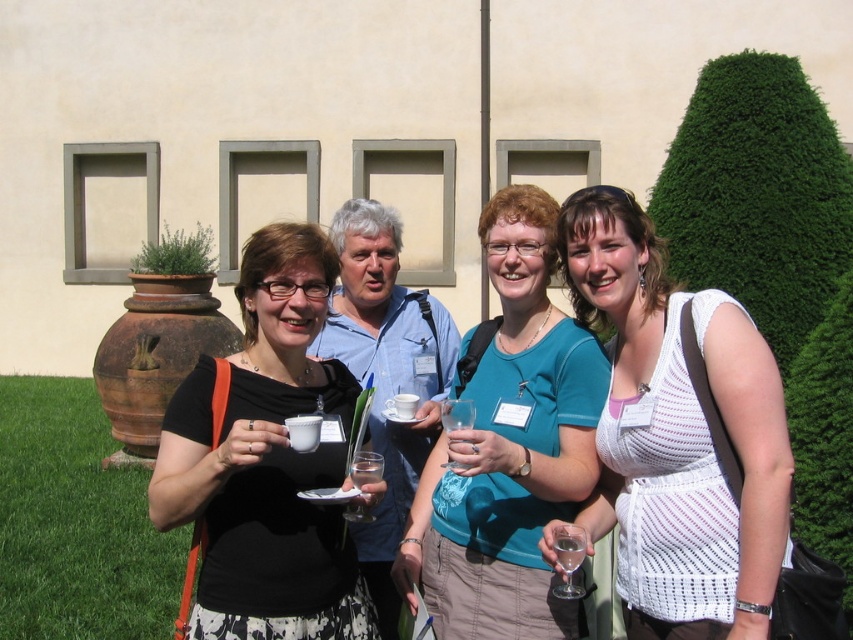
Which is below, white knitted tank top at center or transparent glass at lower right?

Positioned lower is transparent glass at lower right.

Does white knitted tank top at center appear on the right side of transparent glass at lower right?

Correct, you'll find white knitted tank top at center to the right of transparent glass at lower right.

Is point (645, 378) farther from viewer compared to point (581, 528)?

That is True.

Where is `white knitted tank top at center`? The image size is (853, 640). white knitted tank top at center is located at coordinates (677, 436).

Does white knitted tank top at center appear on the left side of teal fabric shirt at center?

No, white knitted tank top at center is not to the left of teal fabric shirt at center.

Does white knitted tank top at center lie in front of teal fabric shirt at center?

Yes, it is.

Measure the distance between white knitted tank top at center and camera.

white knitted tank top at center is 2.69 meters away from camera.

The image size is (853, 640). What are the coordinates of `white knitted tank top at center` in the screenshot? It's located at (677, 436).

Is transparent glass at lower right in front of clear glass at center?

Yes.

Is transparent glass at lower right taller than clear glass at center?

No.

In the scene shown: Measure the distance between point (x=573, y=531) and camera.

Point (x=573, y=531) and camera are 9.66 feet apart.

Locate an element on the screen. This screenshot has width=853, height=640. transparent glass at lower right is located at coordinates (569, 547).